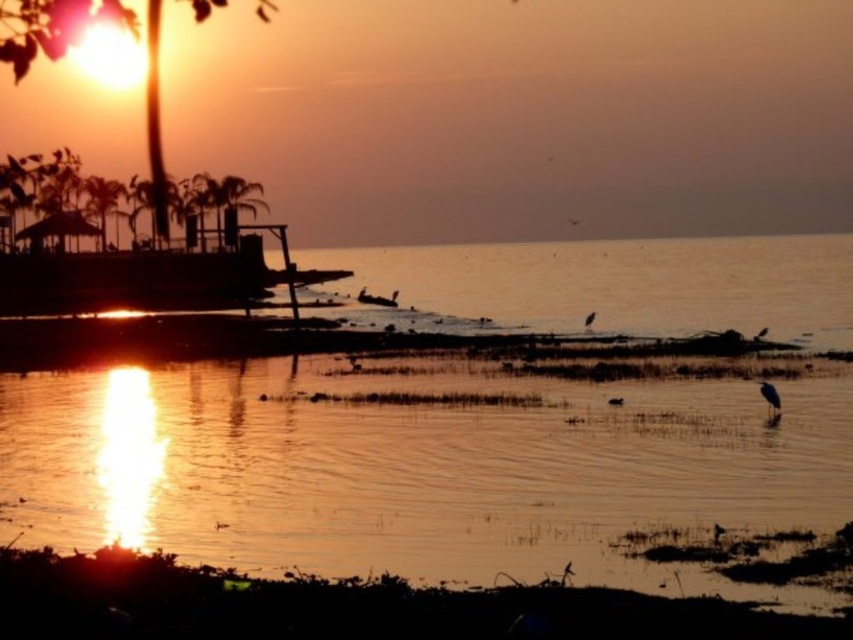
You are standing at the point with coordinates point (761,326) and want to walk towards the sunset. Is the point with coordinates point (115,202) blocking your path?

Point (115,202) is behind point (761,326), so it is not blocking your path towards the sunset.

You are a photographer trying to capture the sunset scene. You notice the green leafy palm tree at upper left and the white matte bird at center. Based on their positions, which object do you think is wider?

The green leafy palm tree at upper left might be wider than the white matte bird at center.